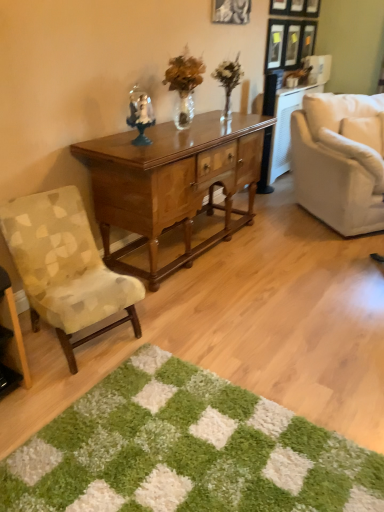
You are a GUI agent. You are given a task and a screenshot of the screen. Output one action in this format:
    pyautogui.click(x=<x>, y=<y>)
    Task: Click on the vacant space to the right of polished wood desk at center
    The height and width of the screenshot is (512, 384).
    Given the screenshot: What is the action you would take?
    pyautogui.click(x=293, y=258)